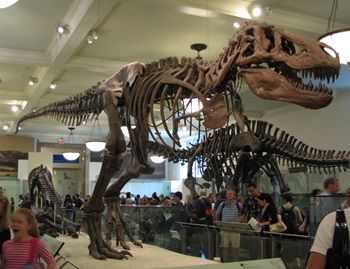
Find the location of a particular element. This screenshot has height=269, width=350. glass case is located at coordinates (160, 219), (199, 238), (282, 250), (320, 204), (301, 197), (131, 214).